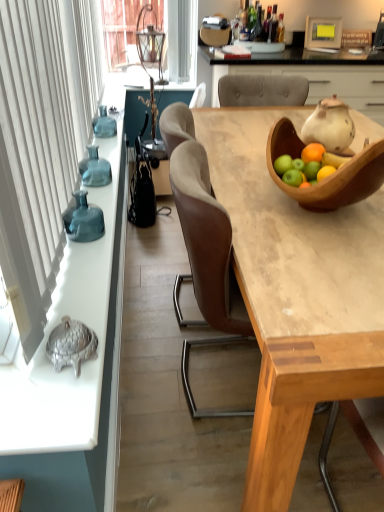
Question: Is translucent glass vase at left thinner than wooden bowl at upper right?

Choices:
 (A) no
 (B) yes

Answer: (B)

Question: From the image's perspective, is translucent glass vase at left over wooden bowl at upper right?

Choices:
 (A) yes
 (B) no

Answer: (A)

Question: Is translucent glass vase at left positioned with its back to wooden bowl at upper right?

Choices:
 (A) yes
 (B) no

Answer: (B)

Question: From the image's perspective, is translucent glass vase at left located beneath wooden bowl at upper right?

Choices:
 (A) yes
 (B) no

Answer: (B)

Question: Does translucent glass vase at left have a lesser height compared to wooden bowl at upper right?

Choices:
 (A) yes
 (B) no

Answer: (A)

Question: From a real-world perspective, is translucent glass vase at left, the 2th vase from the bottom, above or below translucent glass vase at left?

Choices:
 (A) above
 (B) below

Answer: (A)

Question: Is translucent glass vase at left, the second vase positioned from the front, in front of or behind translucent glass vase at left in the image?

Choices:
 (A) behind
 (B) front

Answer: (B)

Question: Considering the positions of translucent glass vase at left, the second vase positioned from the front, and translucent glass vase at left in the image, is translucent glass vase at left, the second vase positioned from the front, wider or thinner than translucent glass vase at left?

Choices:
 (A) thin
 (B) wide

Answer: (A)

Question: From the image's perspective, is translucent glass vase at left, which is the 1th vase from top to bottom, positioned above or below translucent glass vase at left?

Choices:
 (A) below
 (B) above

Answer: (A)

Question: From a real-world perspective, relative to wooden bowl at upper right, is wooden cabinet at upper center vertically above or below?

Choices:
 (A) below
 (B) above

Answer: (A)

Question: From the image's perspective, is wooden cabinet at upper center located above or below wooden bowl at upper right?

Choices:
 (A) above
 (B) below

Answer: (A)

Question: Is wooden cabinet at upper center inside or outside of wooden bowl at upper right?

Choices:
 (A) outside
 (B) inside

Answer: (A)

Question: In terms of size, does wooden cabinet at upper center appear bigger or smaller than wooden bowl at upper right?

Choices:
 (A) big
 (B) small

Answer: (A)

Question: From a real-world perspective, is translucent glass vase at left, the first vase viewed from the back, above or below wooden bowl at upper right?

Choices:
 (A) above
 (B) below

Answer: (B)

Question: Is translucent glass vase at left, the second vase positioned from the front, in front of or behind wooden bowl at upper right in the image?

Choices:
 (A) behind
 (B) front

Answer: (A)